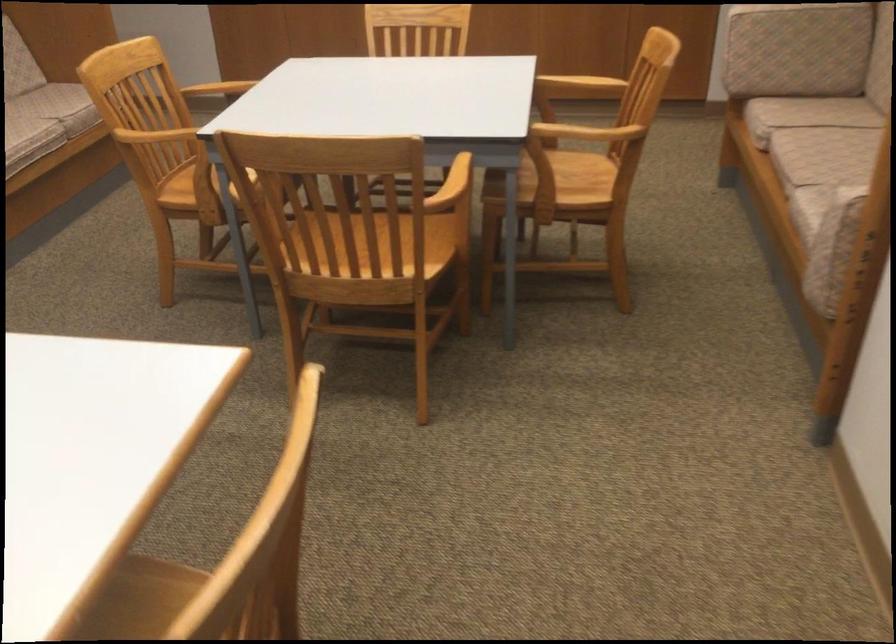
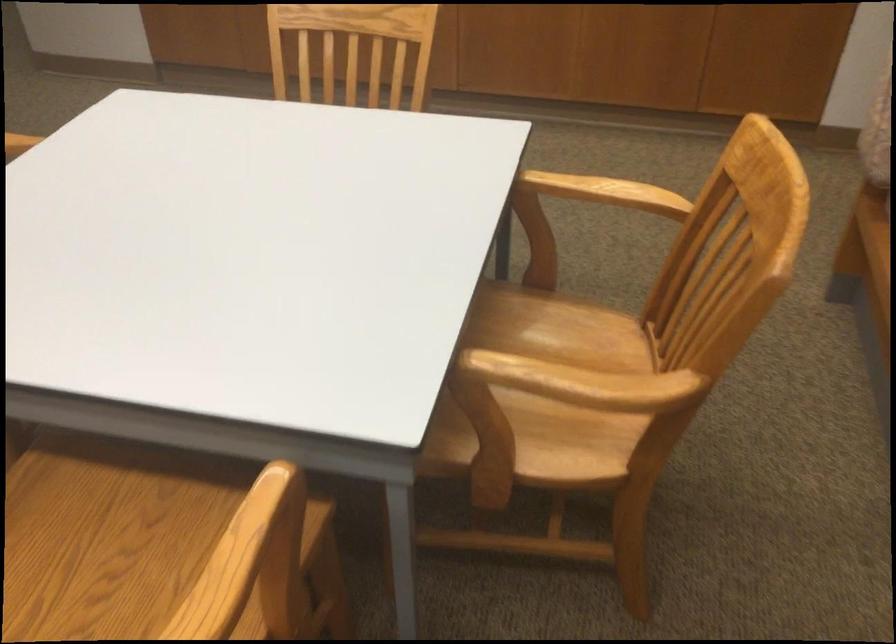
Question: What movement of the cameraman would produce the second image?

Choices:
 (A) Left
 (B) Right
 (C) Forward
 (D) Backward

Answer: (C)